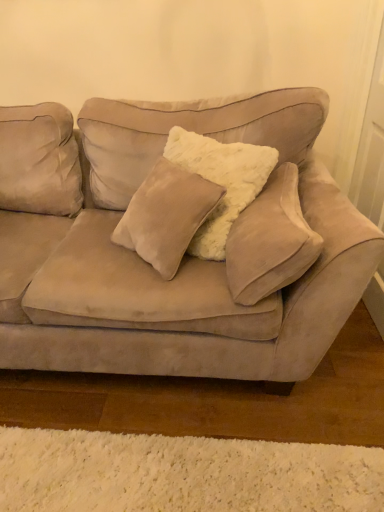
Question: From the image's perspective, is suede couch at center located above or below white fluffy pillow at center?

Choices:
 (A) below
 (B) above

Answer: (B)

Question: Considering the positions of suede couch at center and white fluffy pillow at center in the image, is suede couch at center wider or thinner than white fluffy pillow at center?

Choices:
 (A) wide
 (B) thin

Answer: (A)

Question: Is suede couch at center in front of or behind white fluffy pillow at center in the image?

Choices:
 (A) behind
 (B) front

Answer: (B)

Question: From a real-world perspective, is white fluffy pillow at center physically located above or below suede couch at center?

Choices:
 (A) above
 (B) below

Answer: (A)

Question: Do you think white fluffy pillow at center is within suede couch at center, or outside of it?

Choices:
 (A) inside
 (B) outside

Answer: (A)

Question: Is point (271, 264) positioned closer to the camera than point (44, 297)?

Choices:
 (A) farther
 (B) closer

Answer: (B)

Question: Based on their positions, is white fluffy pillow at center located to the left or right of suede couch at center?

Choices:
 (A) left
 (B) right

Answer: (B)